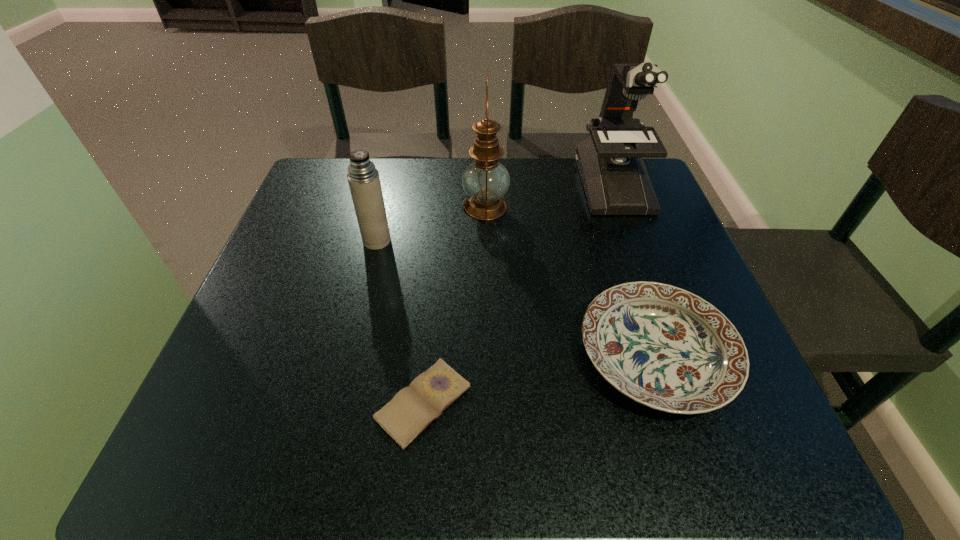
This screenshot has width=960, height=540. I want to click on free space between the diary and the plate, so point(540,379).

Identify the location of free spot between the shortest object and the oil lamp. This screenshot has height=540, width=960. [454, 305].

Find the location of a particular element. empty location between the third shortest object and the diary is located at coordinates (400, 322).

You are a GUI agent. You are given a task and a screenshot of the screen. Output one action in this format:
    pyautogui.click(x=<x>, y=<y>)
    Task: Click on the object that is the second closest to the leftmost object
    This screenshot has height=540, width=960.
    Given the screenshot: What is the action you would take?
    pyautogui.click(x=412, y=409)

You are a GUI agent. You are given a task and a screenshot of the screen. Output one action in this format:
    pyautogui.click(x=<x>, y=<y>)
    Task: Click on the object that is the fourth closest to the fourth tallest object
    
    Given the screenshot: What is the action you would take?
    pyautogui.click(x=363, y=178)

Image resolution: width=960 pixels, height=540 pixels. I want to click on free location that satisfies the following two spatial constraints: 1. on the front side of the diary; 2. on the left side of the leftmost object, so click(337, 403).